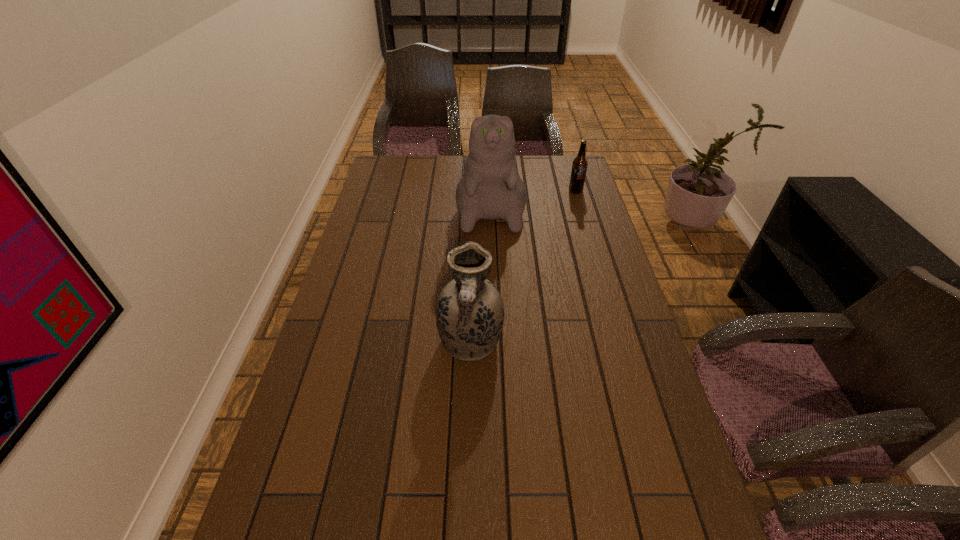
The image size is (960, 540). I want to click on the tallest object, so click(490, 188).

Locate an element on the screen. the second tallest object is located at coordinates (469, 312).

I want to click on vase, so click(469, 312).

You are a GUI agent. You are given a task and a screenshot of the screen. Output one action in this format:
    pyautogui.click(x=<x>, y=<y>)
    Task: Click on the shortest object
    The height and width of the screenshot is (540, 960).
    Given the screenshot: What is the action you would take?
    pyautogui.click(x=580, y=163)

Find the location of a particular element. The height and width of the screenshot is (540, 960). the rightmost object is located at coordinates [x=580, y=163].

Locate an element on the screen. free region located 0.050m on the face of the tallest object is located at coordinates (492, 244).

At what (x,y) coordinates should I click in order to perform the action: click on vacant point located with the handle on the side of the nearest object. Please return your answer as a coordinate pair (x, y). This screenshot has width=960, height=540. Looking at the image, I should click on (467, 529).

In order to click on vacant position located 0.240m on the label of the shortest object in this screenshot , I will do `click(588, 231)`.

Find the location of a particular element. The height and width of the screenshot is (540, 960). object at the far edge is located at coordinates (490, 188).

The height and width of the screenshot is (540, 960). I want to click on object that is positioned at the right edge, so click(580, 163).